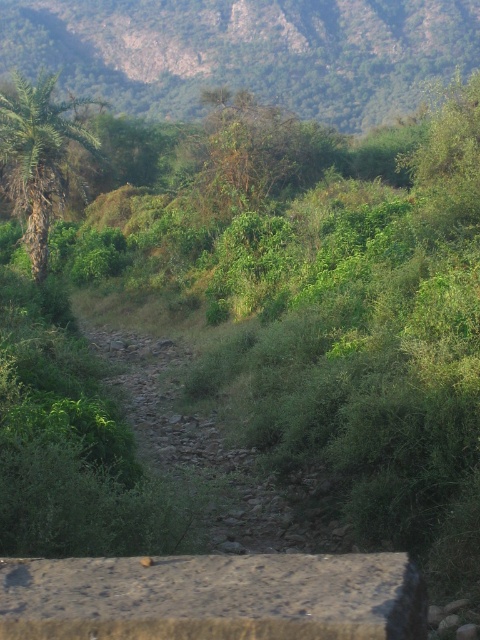
Based on the photo, can you confirm if green leafy hillside at upper center is taller than green leafy palm at left?

Yes.

What do you see at coordinates (245, 51) in the screenshot?
I see `green leafy hillside at upper center` at bounding box center [245, 51].

Locate an element on the screen. green leafy hillside at upper center is located at coordinates (245, 51).